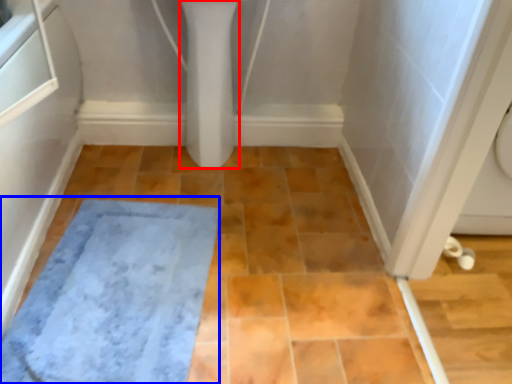
Question: Which of the following is the farthest to the observer, bidet (highlighted by a red box) or bath mat (highlighted by a blue box)?

Choices:
 (A) bidet
 (B) bath mat

Answer: (A)